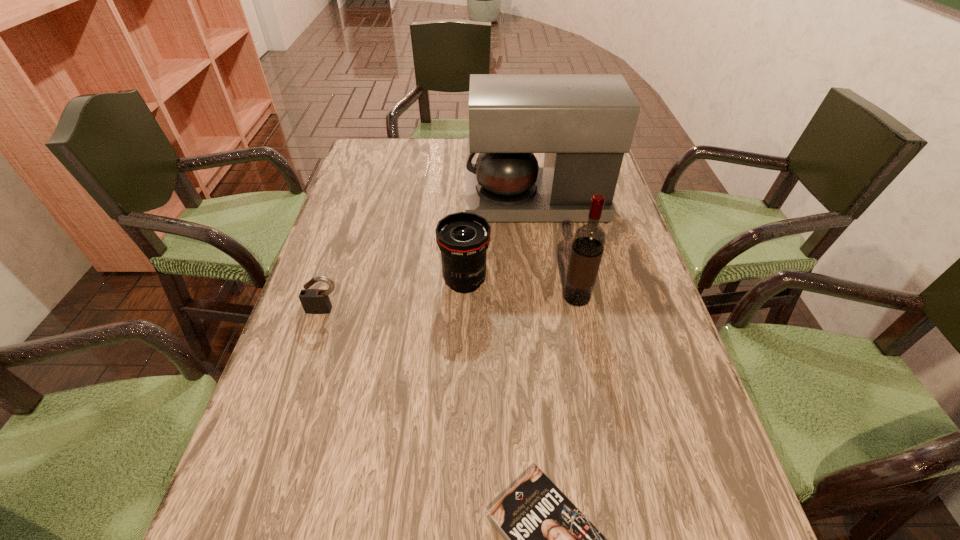
You are a GUI agent. You are given a task and a screenshot of the screen. Output one action in this format:
    pyautogui.click(x=<x>, y=<y>)
    Task: Click on the free space between the tallest object and the second tallest object
    This screenshot has width=960, height=540.
    Given the screenshot: What is the action you would take?
    pyautogui.click(x=557, y=250)

The image size is (960, 540). Find the location of `empty space between the tallest object and the second tallest object`. empty space between the tallest object and the second tallest object is located at coordinates (557, 250).

This screenshot has height=540, width=960. I want to click on vacant area that lies between the telephoto lens and the wine bottle, so click(520, 289).

Where is `free point between the fourth shortest object and the telephoto lens`? free point between the fourth shortest object and the telephoto lens is located at coordinates (520, 289).

Find the location of `free space between the coffee maker and the leftmost object`. free space between the coffee maker and the leftmost object is located at coordinates (430, 256).

Identify the location of empty location between the telephoto lens and the tallest object. The height and width of the screenshot is (540, 960). (500, 242).

Locate an element on the screen. object that can be found as the closest to the wine bottle is located at coordinates (463, 238).

I want to click on object that stands as the closest to the book, so click(x=589, y=239).

I want to click on vacant position in the image that satisfies the following two spatial constraints: 1. on the carafe side of the coffee maker; 2. on the back side of the second tallest object, so click(551, 298).

Identify the location of vacant area that satisfies the following two spatial constraints: 1. on the carafe side of the farthest object; 2. on the left side of the fourth shortest object. (551, 298).